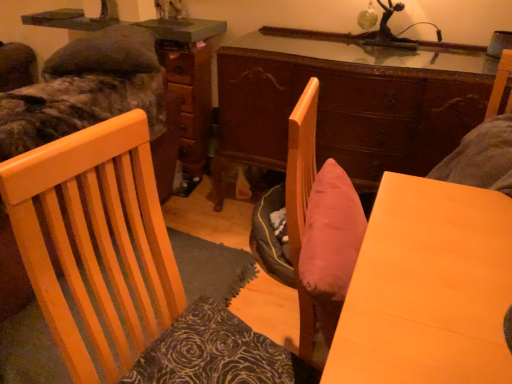
Where is `vacant area on top of wooden table at center (from a real-world perspective)`? This screenshot has width=512, height=384. vacant area on top of wooden table at center (from a real-world perspective) is located at coordinates (450, 277).